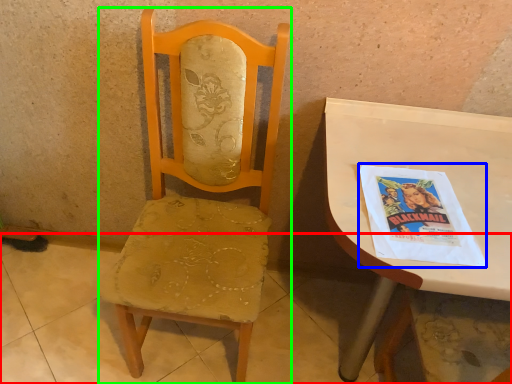
Question: Which is nearer to the concrete (highlighted by a red box)? comic book (highlighted by a blue box) or chair (highlighted by a green box).

Choices:
 (A) comic book
 (B) chair

Answer: (B)